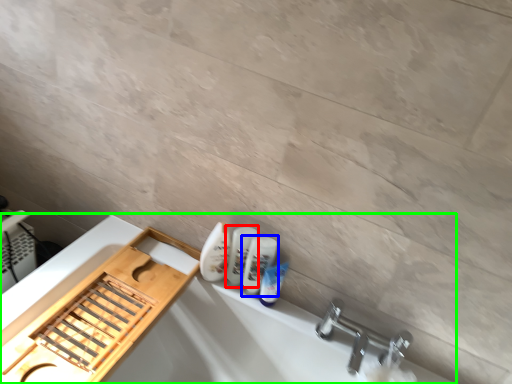
Question: Considering the real-world distances, which object is closest to mouthwash (highlighted by a red box)? mouthwash (highlighted by a blue box) or bath (highlighted by a green box).

Choices:
 (A) mouthwash
 (B) bath

Answer: (A)